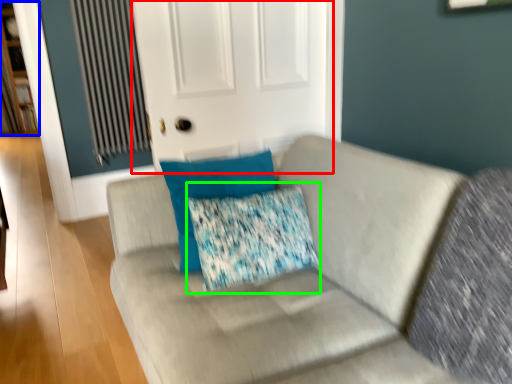
Question: Which object is positioned farthest from screen door (highlighted by a red box)? Select from bookshelf (highlighted by a blue box) and throw pillow (highlighted by a green box).

Choices:
 (A) bookshelf
 (B) throw pillow

Answer: (A)